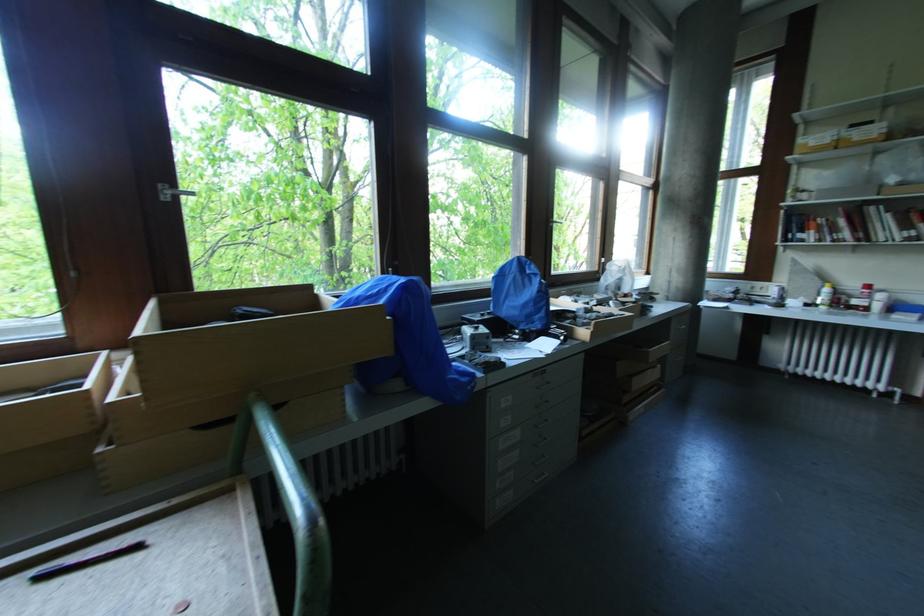
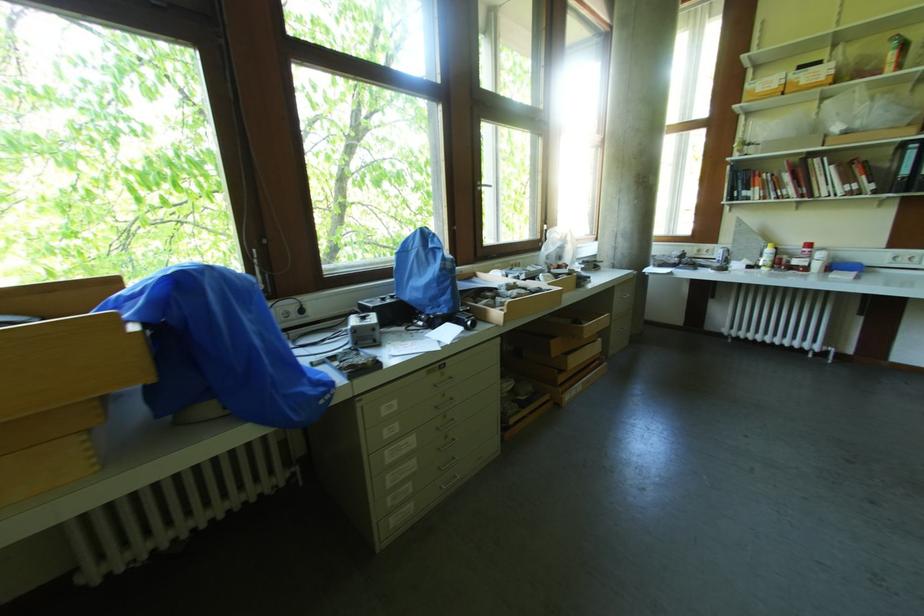
Question: Based on the continuous images, in which direction is the camera rotating? Reply with the corresponding letter.

Choices:
 (A) Left
 (B) Right
 (C) Up
 (D) Down

Answer: (D)